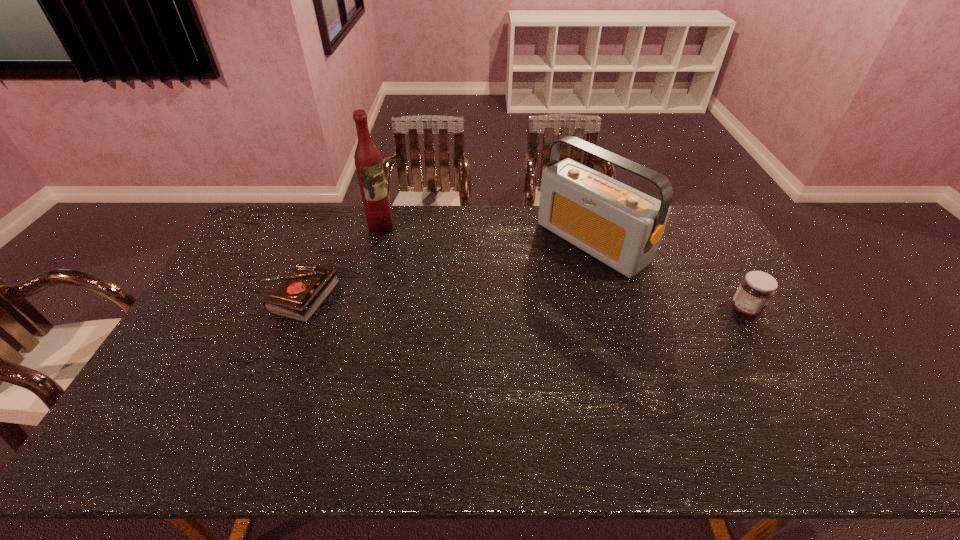
Identify the location of vacant region at the far left corner of the desktop. (262, 237).

Where is `vacant space that is in between the second object from right to left and the second shortest object`? vacant space that is in between the second object from right to left and the second shortest object is located at coordinates (668, 276).

Image resolution: width=960 pixels, height=540 pixels. I want to click on free area in between the third object from left to right and the leftmost object, so click(x=445, y=269).

Locate an element on the screen. The width and height of the screenshot is (960, 540). vacant space in between the leftmost object and the third object from left to right is located at coordinates (445, 269).

Find the location of a particular element. Image resolution: width=960 pixels, height=540 pixels. empty location between the diary and the liquor is located at coordinates (340, 262).

The width and height of the screenshot is (960, 540). Find the location of `empty location between the tallest object and the rightmost object`. empty location between the tallest object and the rightmost object is located at coordinates (563, 269).

Find the location of `free point between the third object from right to left and the radio receiver`. free point between the third object from right to left and the radio receiver is located at coordinates (487, 235).

I want to click on free spot between the rightmost object and the third object from right to left, so click(563, 269).

What are the coordinates of `vacant area that lies between the jam and the radio receiver` in the screenshot? It's located at (668, 276).

This screenshot has height=540, width=960. In order to click on vacant space that's between the third shortest object and the second shortest object in this screenshot , I will do `click(668, 276)`.